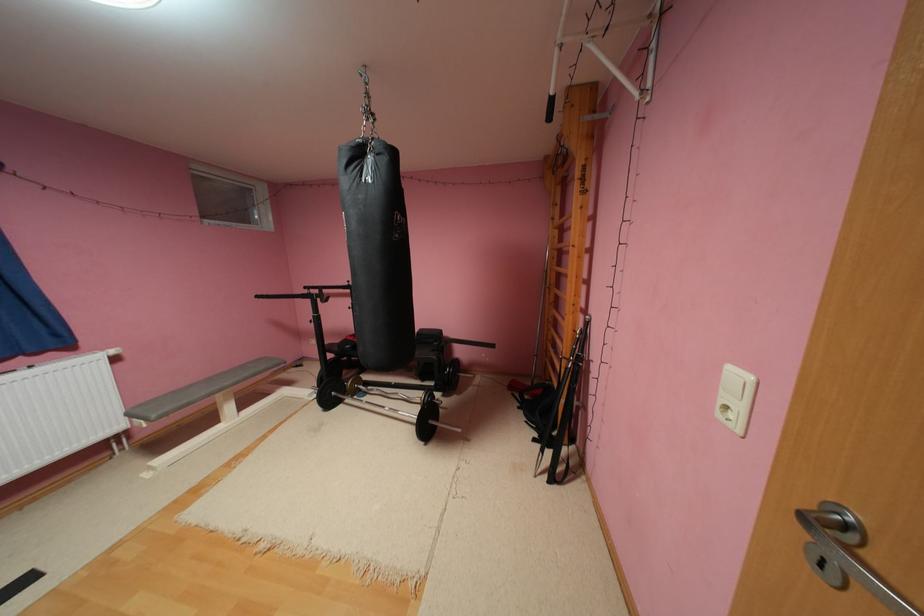
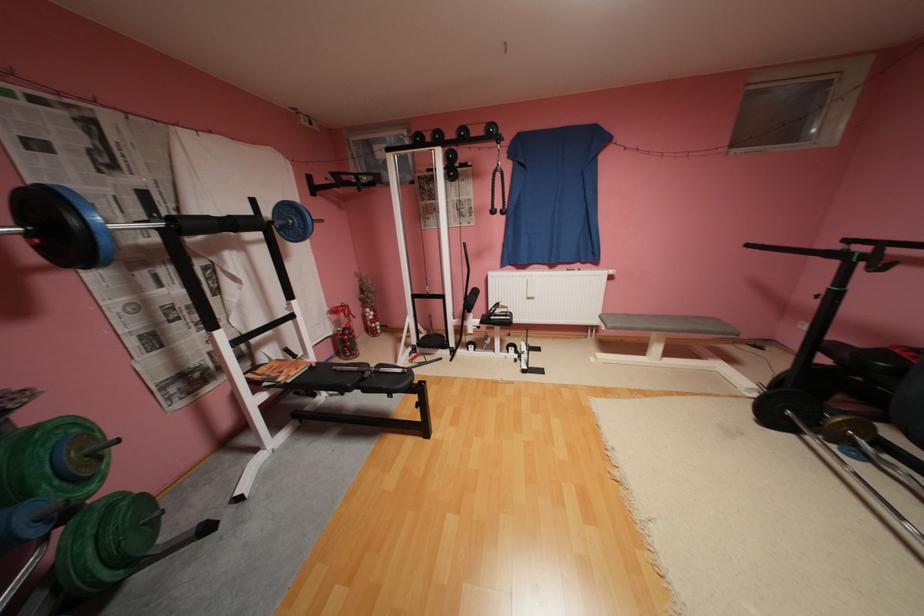
Find the pixel in the second image that matches point (370, 390) in the first image.

(867, 445)